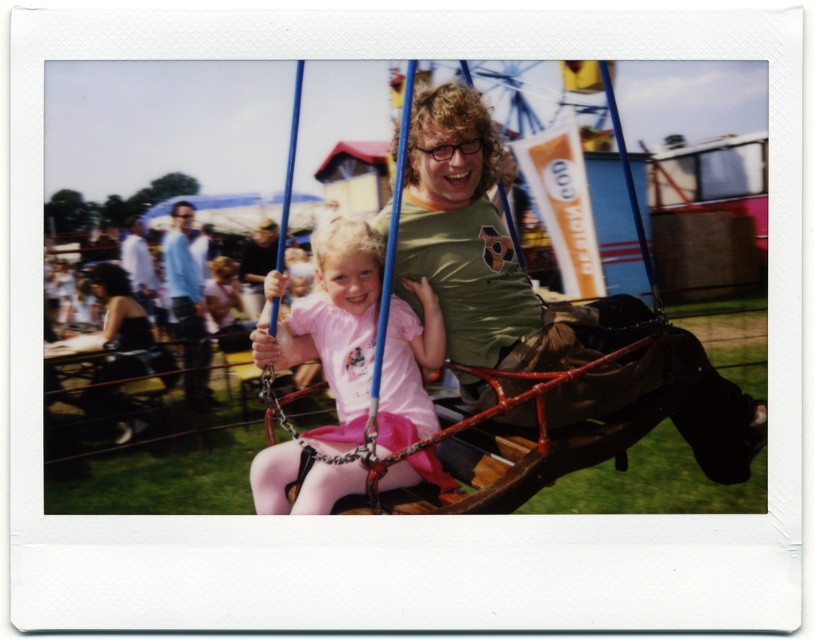
Question: Does pink fabric dress at center have a smaller size compared to white shirt at left?

Choices:
 (A) no
 (B) yes

Answer: (B)

Question: Can you confirm if black leather jacket at lower left is positioned below matte black shirt at center?

Choices:
 (A) no
 (B) yes

Answer: (B)

Question: Which point appears farthest from the camera in this image?

Choices:
 (A) (132, 224)
 (B) (165, 248)
 (C) (241, 272)

Answer: (A)

Question: Which point appears closest to the camera in this image?

Choices:
 (A) pyautogui.click(x=383, y=276)
 (B) pyautogui.click(x=204, y=401)

Answer: (A)

Question: Which object appears closest to the camera in this image?

Choices:
 (A) light blue shirt at left
 (B) matte black shirt at center

Answer: (A)

Question: Does wooden swing at center have a lesser width compared to matte black shirt at center?

Choices:
 (A) no
 (B) yes

Answer: (A)